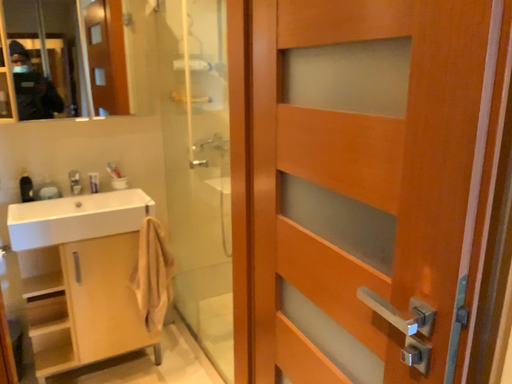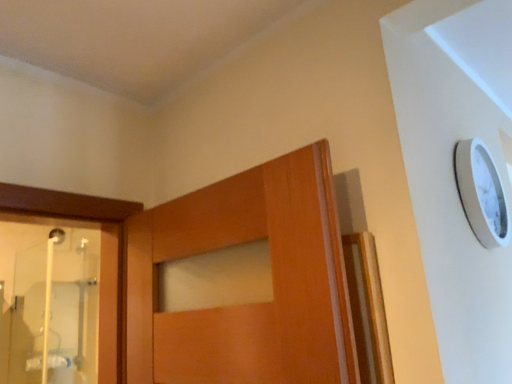
Question: Which way did the camera rotate in the video?

Choices:
 (A) rotated downward
 (B) rotated upward

Answer: (B)